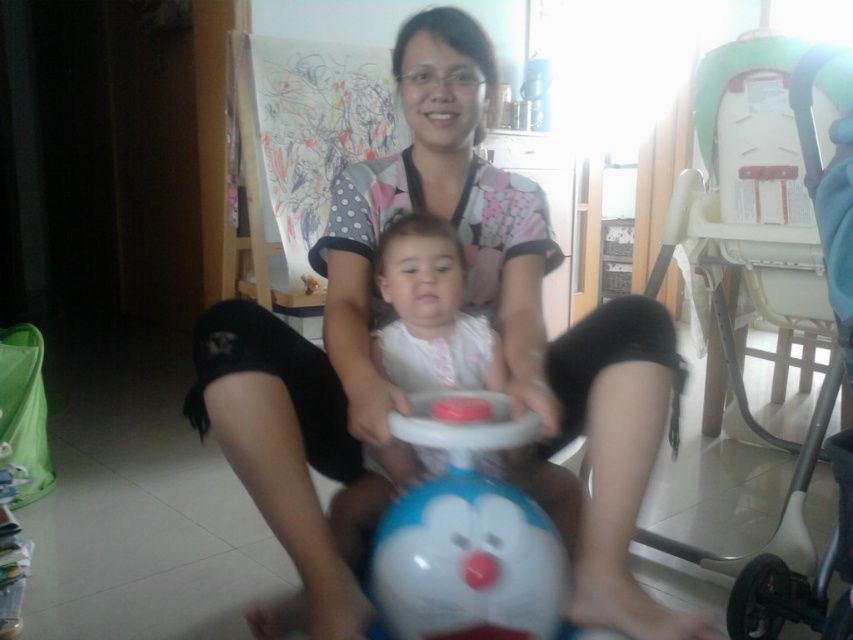
Question: Is matte black shorts at center above white glossy toy at center?

Choices:
 (A) no
 (B) yes

Answer: (B)

Question: Is matte black shorts at center closer to camera compared to white glossy toy at center?

Choices:
 (A) no
 (B) yes

Answer: (A)

Question: Estimate the real-world distances between objects in this image. Which object is closer to the white glossy toy at center?

Choices:
 (A) matte black shorts at center
 (B) white plastic baby carriage at upper right

Answer: (A)

Question: Does white plastic baby carriage at upper right come behind white glossy toy at center?

Choices:
 (A) yes
 (B) no

Answer: (A)

Question: Which of the following is the closest to the observer?

Choices:
 (A) (409, 596)
 (B) (843, 355)
 (C) (532, 237)

Answer: (A)

Question: Which point is closer to the camera taking this photo?

Choices:
 (A) (556, 636)
 (B) (704, 260)

Answer: (A)